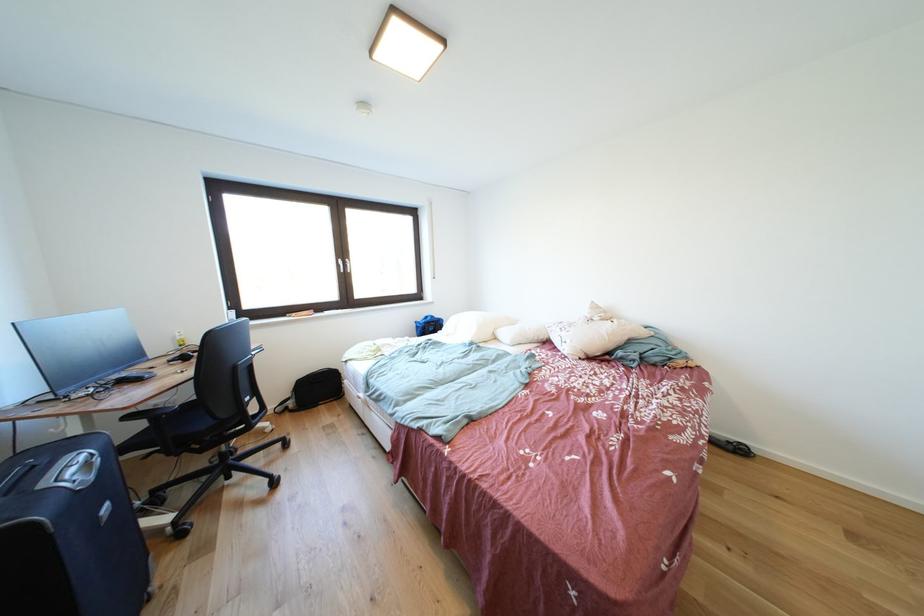
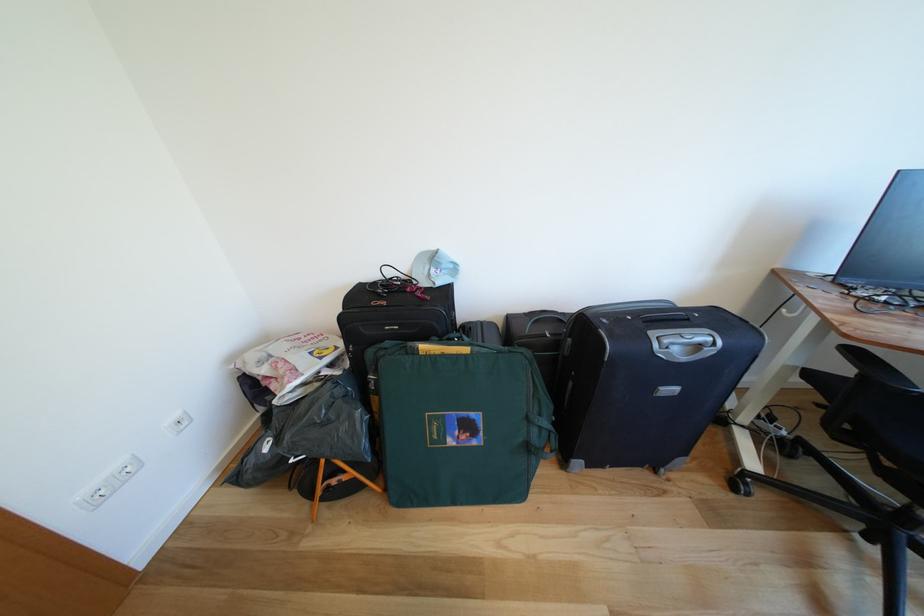
Where in the second image is the point corresponding to [139,422] from the first image?

(862, 357)